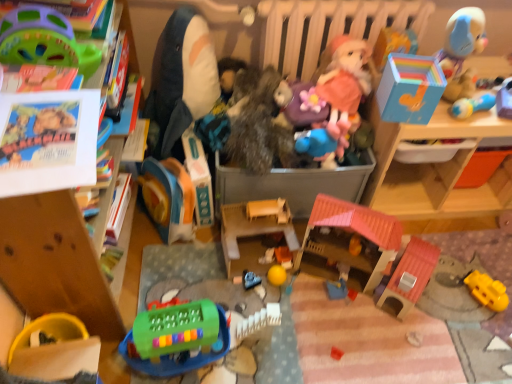
The image size is (512, 384). Identify the location of vacant space that's between yellow plastic blocks at lower right, acting as the fifteenth toy starting from the left, and yellow rubber ball at center, the ninth toy when ordered from left to right. (378, 301).